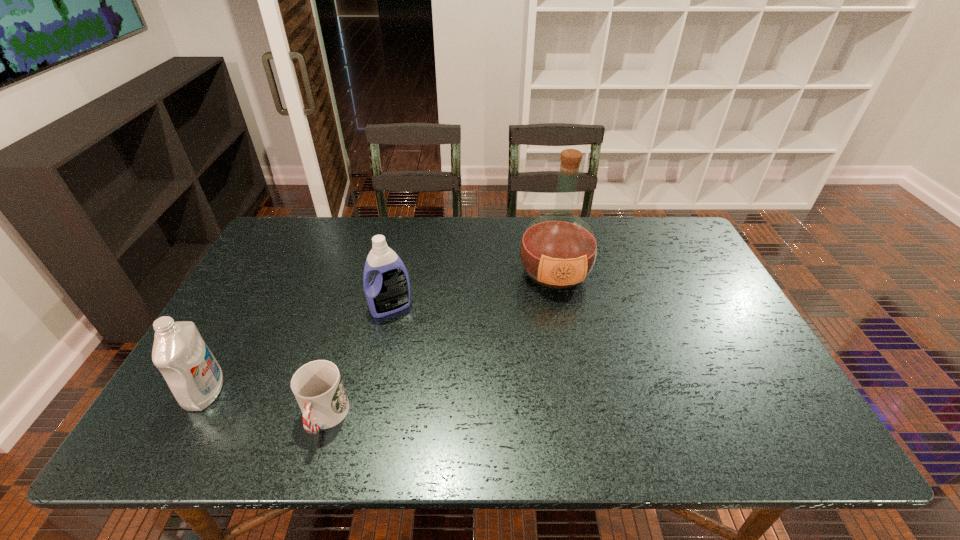
Find the location of a particular element. The image size is (960, 540). object that stands as the third closest to the shortest object is located at coordinates (558, 250).

Where is `free space that satisfies the following two spatial constraints: 1. on the back side of the farther detergent; 2. on the left side of the left detergent`? The height and width of the screenshot is (540, 960). free space that satisfies the following two spatial constraints: 1. on the back side of the farther detergent; 2. on the left side of the left detergent is located at coordinates (252, 307).